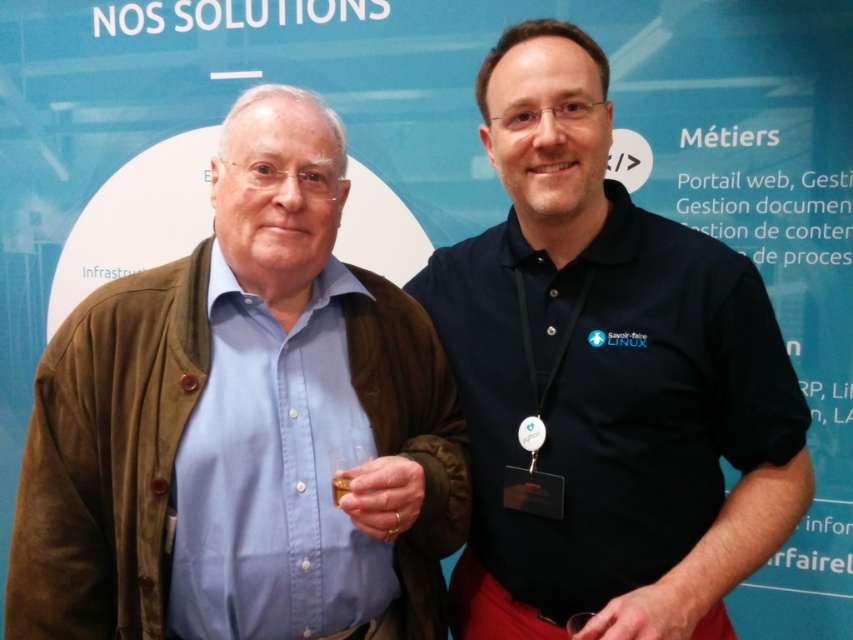
Question: Which of the following is the farthest from the observer?

Choices:
 (A) blue cotton shirt at left
 (B) dark blue shirt at center

Answer: (B)

Question: Which of the following is the closest to the observer?

Choices:
 (A) silver metallic medal at center
 (B) dark blue shirt at center

Answer: (B)

Question: In this image, where is blue cotton shirt at left located relative to dark blue shirt at center?

Choices:
 (A) below
 (B) above

Answer: (A)

Question: Does blue cotton shirt at left have a lesser width compared to silver metallic medal at center?

Choices:
 (A) no
 (B) yes

Answer: (A)

Question: Does blue cotton shirt at left have a larger size compared to dark blue shirt at center?

Choices:
 (A) no
 (B) yes

Answer: (A)

Question: Which object is the closest to the blue cotton shirt at left?

Choices:
 (A) silver metallic medal at center
 (B) dark blue shirt at center

Answer: (B)